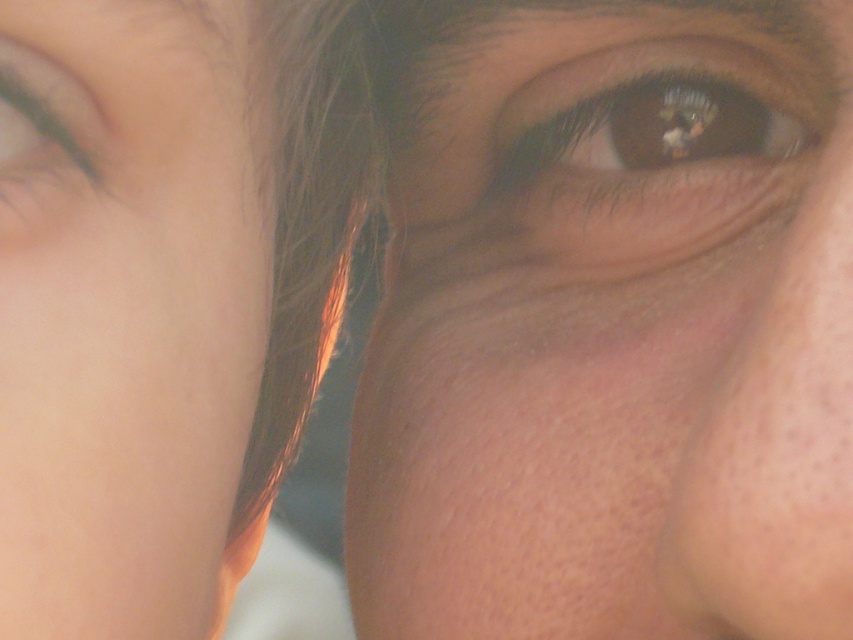
You are a photographer adjusting the focus on a portrait. You want to ensure both the brown matte eye at upper center and the brown matte eye at upper left are in focus. Given that your camera can focus on objects within a 12 cm range, will both eyes be in focus?

The brown matte eye at upper center is 13.69 centimeters from the brown matte eye at upper left. Since the distance between them exceeds the camera focus range of 12 cm, both eyes cannot be in focus simultaneously.

You are taking a photo and want to ensure that both the smooth skin at left and the brown matte eye at upper center are in focus. Based on their positions, which one is more likely to be in focus first?

The smooth skin at left is closer to the viewer than the brown matte eye at upper center, so it will be in focus first.